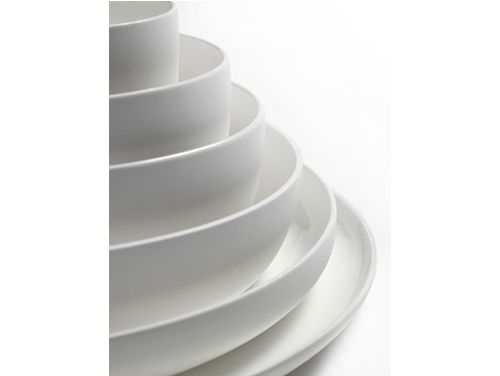
The width and height of the screenshot is (500, 376). I want to click on dish wear, so click(x=270, y=359), click(x=222, y=332), click(x=177, y=279), click(x=176, y=202), click(x=139, y=103), click(x=122, y=48).